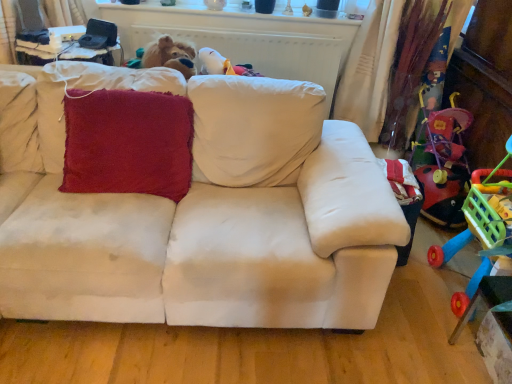
Question: Can you confirm if beige fabric couch at center is taller than velvety red cushion at center?

Choices:
 (A) yes
 (B) no

Answer: (A)

Question: Does beige fabric couch at center turn towards velvety red cushion at center?

Choices:
 (A) yes
 (B) no

Answer: (A)

Question: Does beige fabric couch at center have a greater width compared to velvety red cushion at center?

Choices:
 (A) yes
 (B) no

Answer: (A)

Question: From the image's perspective, is beige fabric couch at center below velvety red cushion at center?

Choices:
 (A) yes
 (B) no

Answer: (A)

Question: From a real-world perspective, is beige fabric couch at center below velvety red cushion at center?

Choices:
 (A) no
 (B) yes

Answer: (B)

Question: Is beige fabric couch at center far away from velvety red cushion at center?

Choices:
 (A) no
 (B) yes

Answer: (A)

Question: From a real-world perspective, is beige fabric couch at center positioned under rubberized plastic shopping cart at right based on gravity?

Choices:
 (A) no
 (B) yes

Answer: (B)

Question: Is beige fabric couch at center wider than rubberized plastic shopping cart at right?

Choices:
 (A) no
 (B) yes

Answer: (B)

Question: Is beige fabric couch at center positioned with its back to rubberized plastic shopping cart at right?

Choices:
 (A) yes
 (B) no

Answer: (B)

Question: Considering the relative sizes of beige fabric couch at center and rubberized plastic shopping cart at right in the image provided, is beige fabric couch at center bigger than rubberized plastic shopping cart at right?

Choices:
 (A) no
 (B) yes

Answer: (B)

Question: From a real-world perspective, is beige fabric couch at center on rubberized plastic shopping cart at right?

Choices:
 (A) yes
 (B) no

Answer: (B)

Question: From the image's perspective, is beige fabric couch at center located beneath rubberized plastic shopping cart at right?

Choices:
 (A) no
 (B) yes

Answer: (A)

Question: Is rubberized plastic shopping cart at right outside velvety red cushion at center?

Choices:
 (A) no
 (B) yes

Answer: (B)